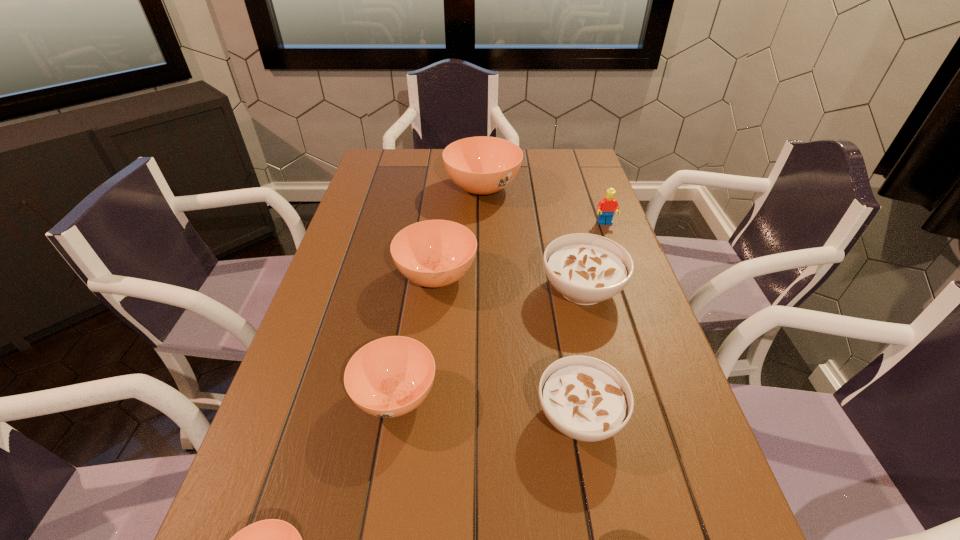
Image resolution: width=960 pixels, height=540 pixels. Identify the location of blank space at the far left corner of the desktop. (391, 172).

In order to click on empty location between the biggest peach soup bowl and the smaller white soup bowl in this screenshot , I will do `click(531, 302)`.

The height and width of the screenshot is (540, 960). In order to click on vacant area between the farther white soup bowl and the third farthest peach soup bowl in this screenshot , I will do `click(489, 342)`.

Select which object is the third closest to the third smallest peach soup bowl. Please provide its 2D coordinates. Your answer should be formatted as a tuple, i.e. [(x, y)], where the tuple contains the x and y coordinates of a point satisfying the conditions above.

[(482, 165)]

Select which object is the second closest to the bigger white soup bowl. Please provide its 2D coordinates. Your answer should be formatted as a tuple, i.e. [(x, y)], where the tuple contains the x and y coordinates of a point satisfying the conditions above.

[(585, 398)]

Find the location of a particular element. The width and height of the screenshot is (960, 540). soup bowl that stands as the fourth closest to the nearest peach soup bowl is located at coordinates (586, 269).

The height and width of the screenshot is (540, 960). In order to click on soup bowl that is the fifth closest to the biggest peach soup bowl in this screenshot , I will do `click(272, 539)`.

Identify which peach soup bowl is the third nearest to the second farthest object. Please provide its 2D coordinates. Your answer should be formatted as a tuple, i.e. [(x, y)], where the tuple contains the x and y coordinates of a point satisfying the conditions above.

[(389, 377)]

The height and width of the screenshot is (540, 960). What are the coordinates of `peach soup bowl that is the closest to the second farthest peach soup bowl` in the screenshot? It's located at (389, 377).

This screenshot has width=960, height=540. In order to click on white soup bowl that can be found as the closest to the farthest peach soup bowl in this screenshot , I will do `click(586, 269)`.